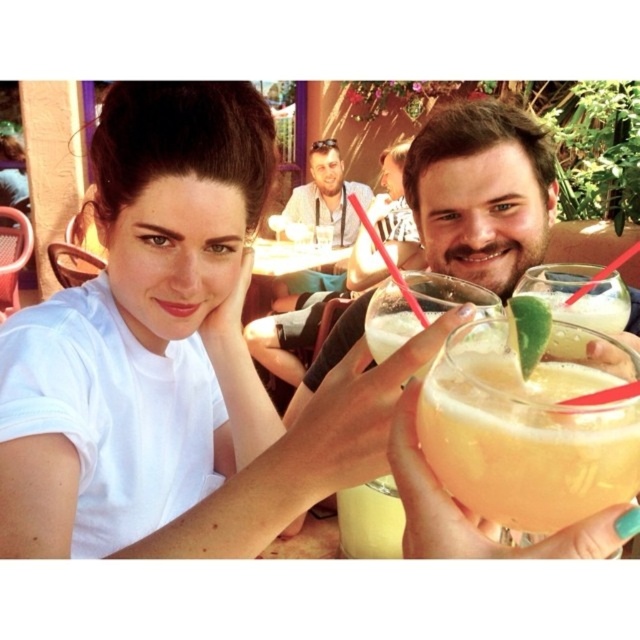
Question: Which object is positioned farthest from the white glossy table at center?

Choices:
 (A) translucent yellow drink at center
 (B) matte white shirt at center
 (C) translucent glass at center

Answer: (A)

Question: Does translucent yellow drink at center appear on the right side of white glossy table at center?

Choices:
 (A) yes
 (B) no

Answer: (A)

Question: Does translucent glass at center have a greater width compared to white glossy table at center?

Choices:
 (A) no
 (B) yes

Answer: (A)

Question: Is matte white shirt at center smaller than white glossy table at center?

Choices:
 (A) yes
 (B) no

Answer: (B)

Question: Which point appears closest to the camera in this image?

Choices:
 (A) (566, 524)
 (B) (467, 291)
 (C) (308, 188)
 (D) (276, 268)

Answer: (A)

Question: Estimate the real-world distances between objects in this image. Which object is closer to the white glossy table at center?

Choices:
 (A) matte white shirt at center
 (B) translucent glass at center

Answer: (A)